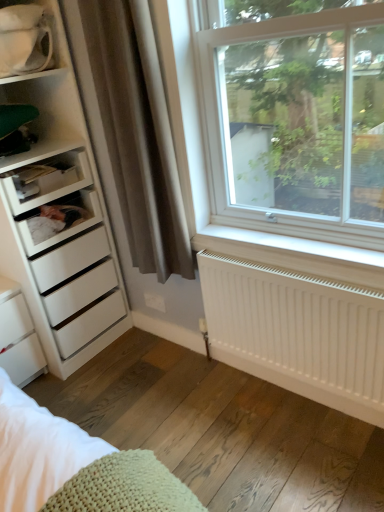
Where is `vacant space underneath brown fabric curtain at left (from a real-world perspective)`? vacant space underneath brown fabric curtain at left (from a real-world perspective) is located at coordinates (166, 355).